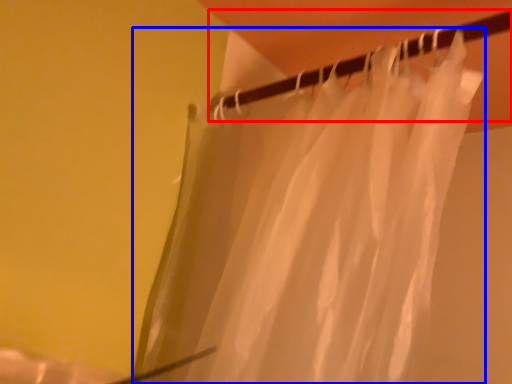
Question: Which object appears farthest to the camera in this image, clothesline (highlighted by a red box) or curtain (highlighted by a blue box)?

Choices:
 (A) clothesline
 (B) curtain

Answer: (A)